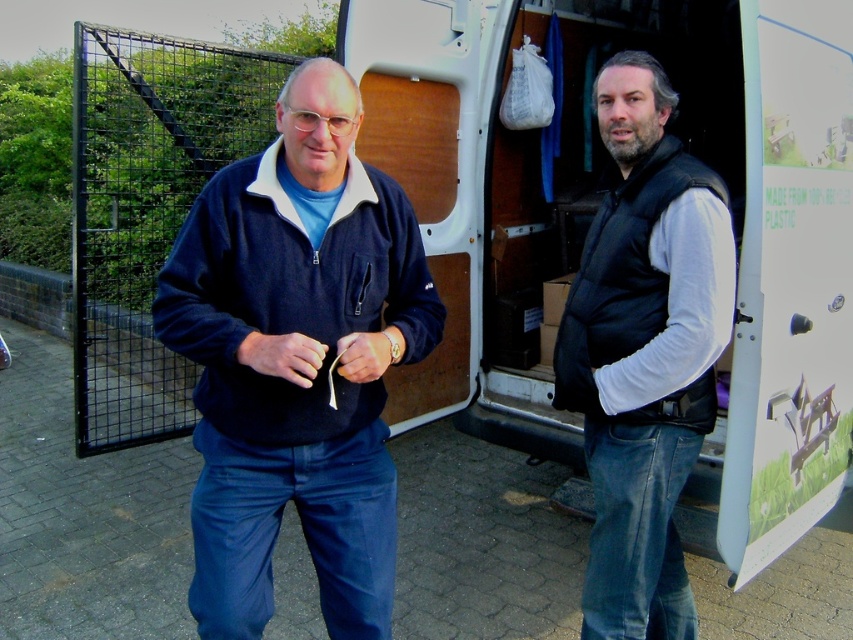
You are standing at the back door of the white van and want to place a small package on the ground. You have two points marked as possible locations. Which point, point (x=805, y=60) or point (x=614, y=321), is closer to the back door of the van?

Point (x=614, y=321) is closer to the back door of the van because it is in front of point (x=805, y=60), which is behind it.

What are the coordinates of the navy fleece jacket at center?

The navy fleece jacket at center is located at coordinates point (297, 362).